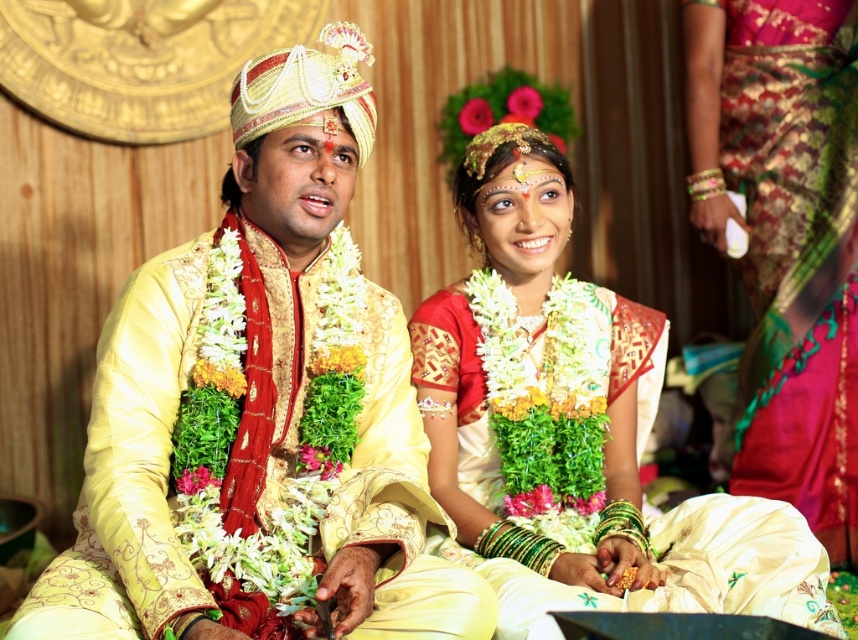
You are a GUI agent. You are given a task and a screenshot of the screen. Output one action in this format:
    pyautogui.click(x=<x>, y=<y>)
    Task: Click on the matte gold kurta at center
    The image size is (858, 640).
    Given the screenshot: What is the action you would take?
    pyautogui.click(x=261, y=408)

Who is shorter, matte gold saree at center or silky pink saree at right?

With less height is matte gold saree at center.

Does matte gold saree at center have a smaller size compared to silky pink saree at right?

Actually, matte gold saree at center might be larger than silky pink saree at right.

What are the coordinates of `matte gold saree at center` in the screenshot? It's located at (573, 428).

Image resolution: width=858 pixels, height=640 pixels. Identify the location of matte gold saree at center. (573, 428).

Which is in front, point (313, 243) or point (520, 241)?

Point (313, 243) is more forward.

Is matte gold kurta at center shorter than matte gold saree at center?

Incorrect, matte gold kurta at center's height does not fall short of matte gold saree at center's.

Is point (214, 406) more distant than point (472, 292)?

No, (214, 406) is closer to viewer.

This screenshot has width=858, height=640. Find the location of `matte gold kurta at center`. matte gold kurta at center is located at coordinates click(x=261, y=408).